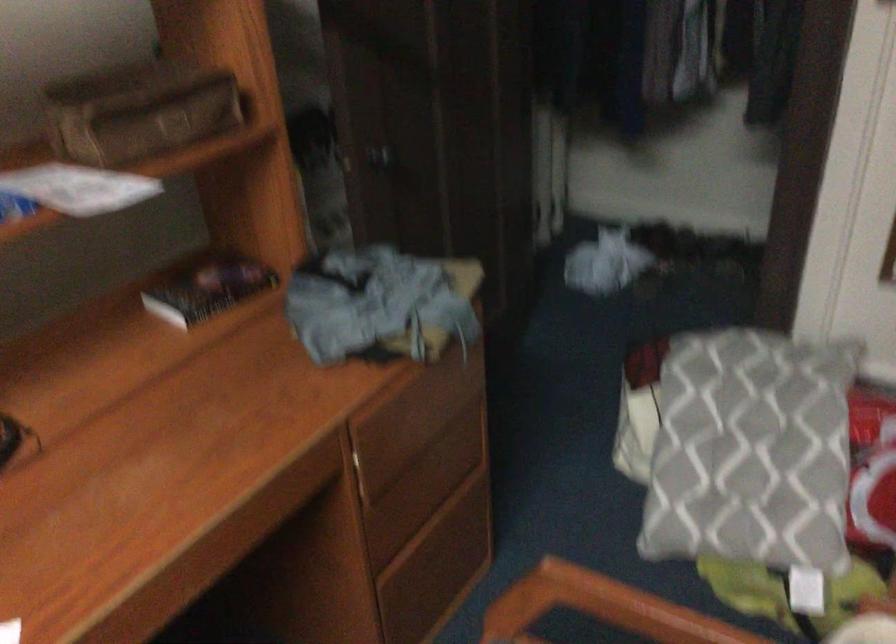
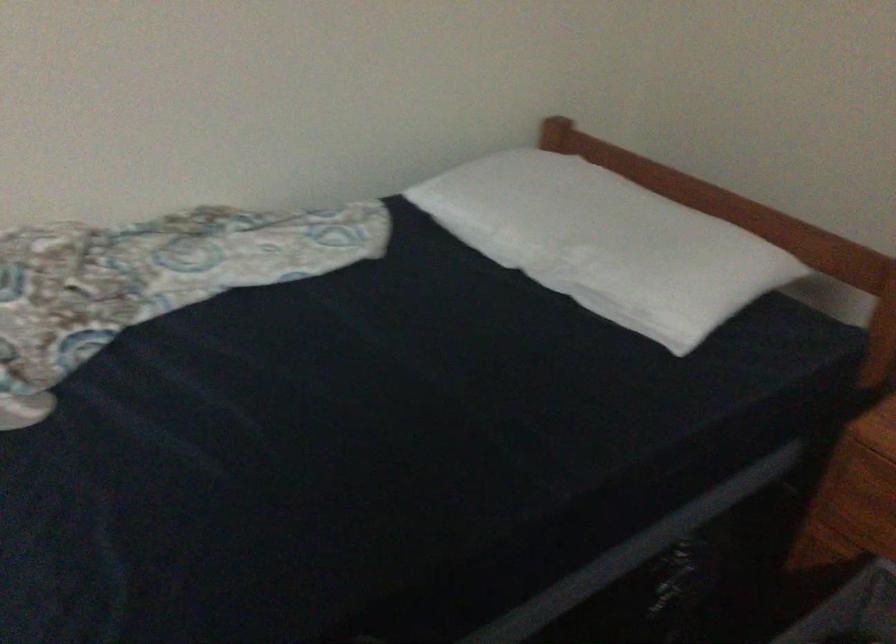
Question: Based on the continuous images, in which direction is the camera rotating? Reply with the corresponding letter.

Choices:
 (A) Left
 (B) Right
 (C) Up
 (D) Down

Answer: (B)